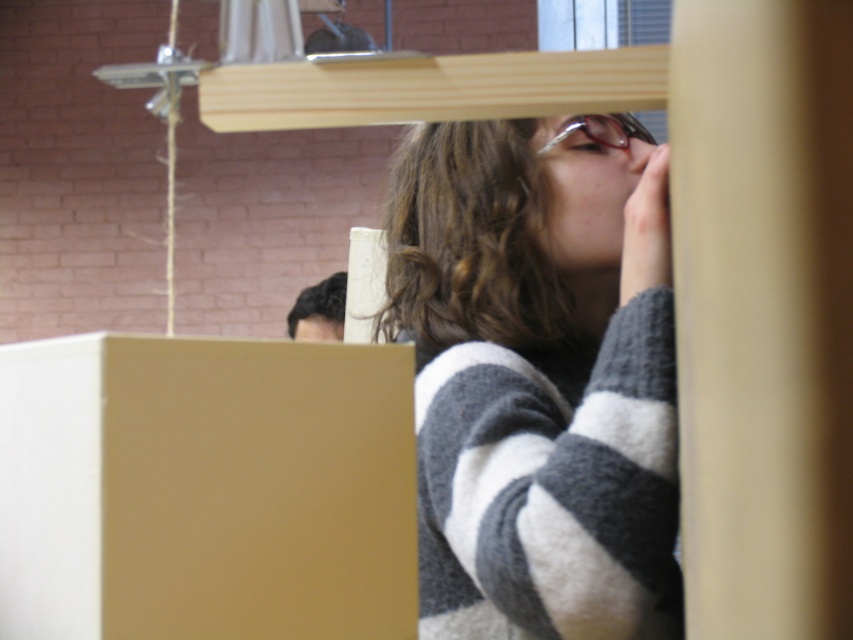
You are an inspector checking the workshop for safety hazards. You notice the matte cardboard box at lower left and the clear plastic goggles at upper center. Which object is nearer to you as you stand at the entrance?

The matte cardboard box at lower left is closer to the viewer than the clear plastic goggles at upper center, so the box is nearer to you.

You are an observer in the studio. You notice the striped sweater at upper right and the clear plastic goggles at upper center. Which object is located more to the left?

The striped sweater at upper right is positioned on the left side of clear plastic goggles at upper center, so the striped sweater at upper right is more to the left.